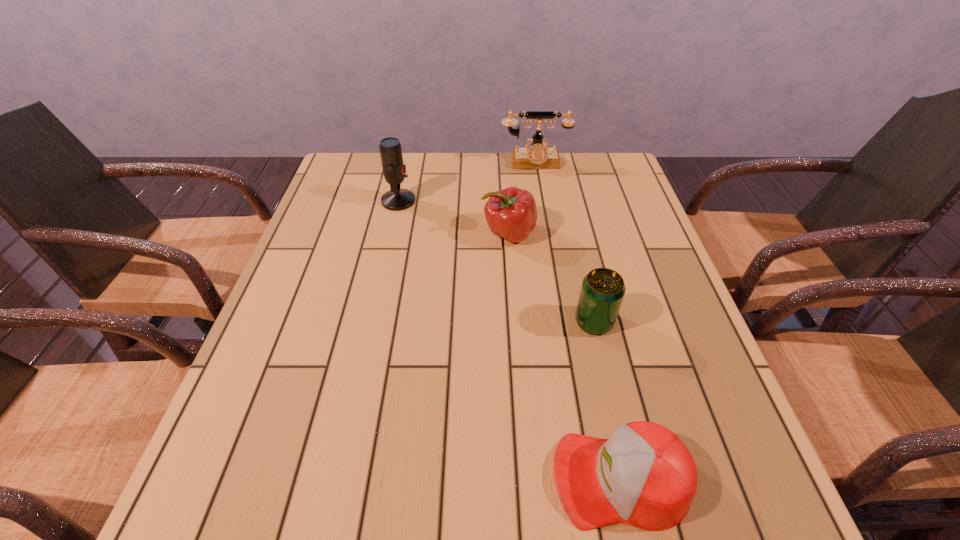
The image size is (960, 540). What are the coordinates of `empty space that is in between the pepper and the shortest object` in the screenshot? It's located at (564, 356).

I want to click on vacant area between the farthest object and the beer can, so click(x=564, y=242).

Locate an element on the screen. The height and width of the screenshot is (540, 960). vacant area between the nearest object and the third farthest object is located at coordinates click(564, 356).

This screenshot has height=540, width=960. What are the coordinates of `object that stands as the third closest to the farthest object` in the screenshot? It's located at (602, 291).

Where is `object that ranks as the closest to the third nearest object`? object that ranks as the closest to the third nearest object is located at coordinates (394, 170).

At what (x,y) coordinates should I click in order to perform the action: click on free space that satisfies the following two spatial constraints: 1. on the dial of the farthest object; 2. on the side of the leftmost object with the red ring. Please return your answer as a coordinate pair (x, y). This screenshot has width=960, height=540. Looking at the image, I should click on (540, 201).

I want to click on vacant space that satisfies the following two spatial constraints: 1. on the side of the third nearest object with the red ring; 2. on the left side of the second farthest object, so click(x=391, y=234).

Where is `free location that satisfies the following two spatial constraints: 1. on the side of the microphone with the red ring; 2. on the left side of the fourth farthest object`? free location that satisfies the following two spatial constraints: 1. on the side of the microphone with the red ring; 2. on the left side of the fourth farthest object is located at coordinates (372, 322).

What are the coordinates of `vacant position in the image that satisfies the following two spatial constraints: 1. on the side of the third farthest object with the red ring; 2. on the left side of the leftmost object` in the screenshot? It's located at (391, 234).

The height and width of the screenshot is (540, 960). Find the location of `vacant position in the image that satisfies the following two spatial constraints: 1. on the side of the beer can with the red ring; 2. on the left side of the second farthest object`. vacant position in the image that satisfies the following two spatial constraints: 1. on the side of the beer can with the red ring; 2. on the left side of the second farthest object is located at coordinates (372, 322).